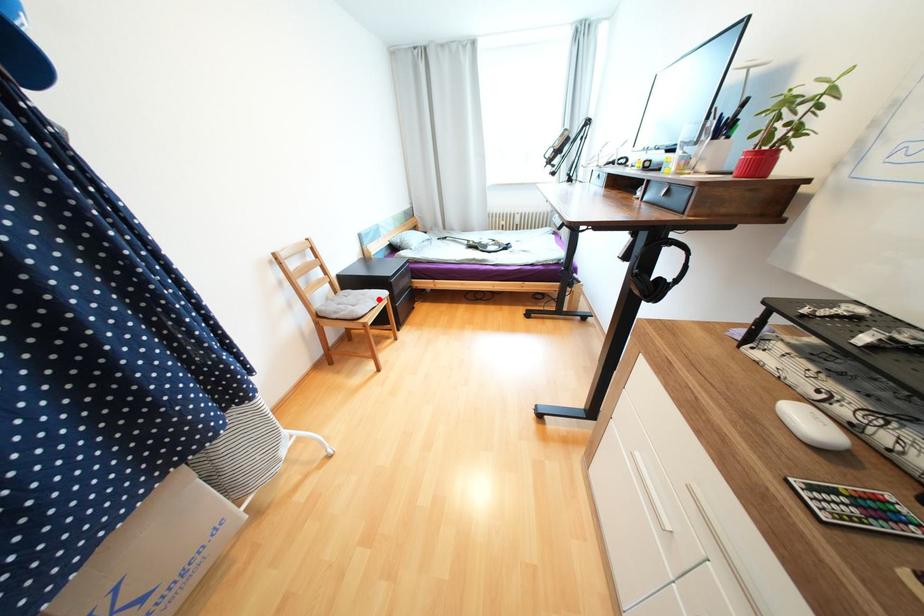
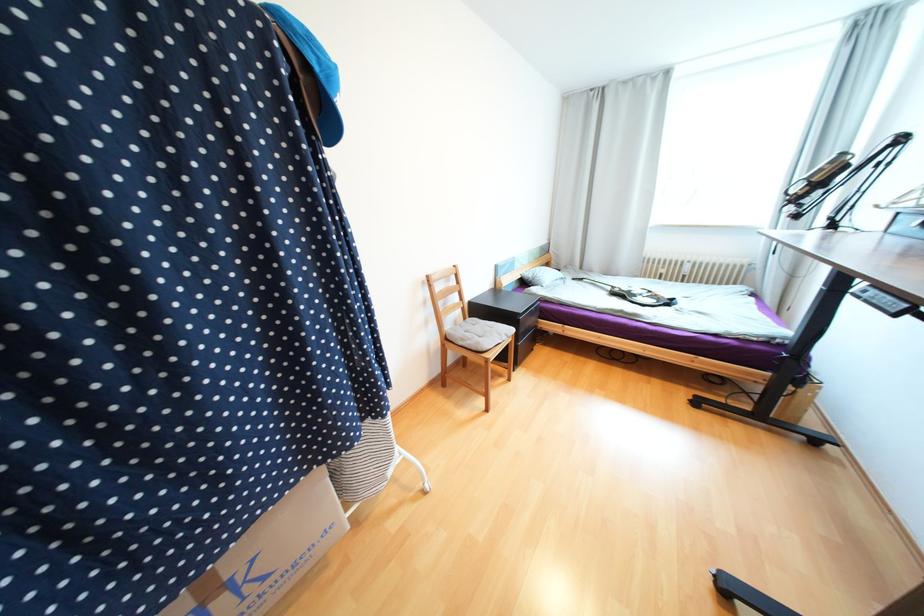
Find the pixel in the second image that matches the highlighted location in the first image.

(505, 334)